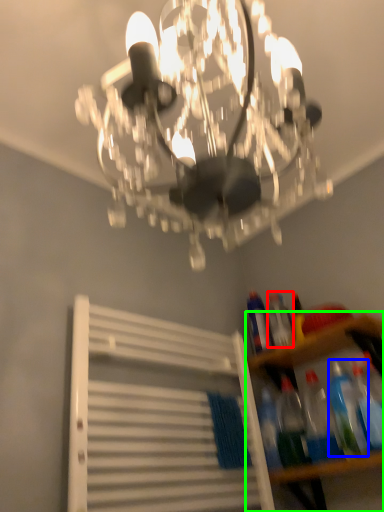
Question: Estimate the real-world distances between objects in this image. Which object is closer to bottle (highlighted by a red box), bottle (highlighted by a blue box) or shelf (highlighted by a green box)?

Choices:
 (A) bottle
 (B) shelf

Answer: (B)